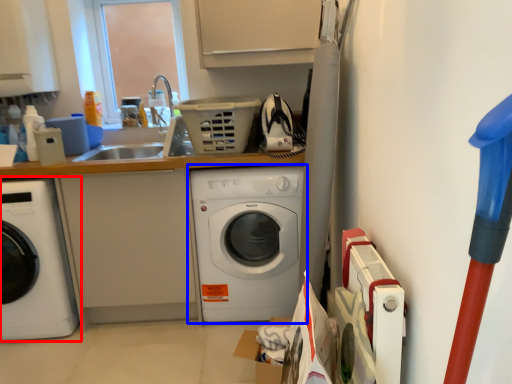
Question: Which object is closer to the camera taking this photo, washing machine (highlighted by a red box) or washing machine (highlighted by a blue box)?

Choices:
 (A) washing machine
 (B) washing machine

Answer: (A)